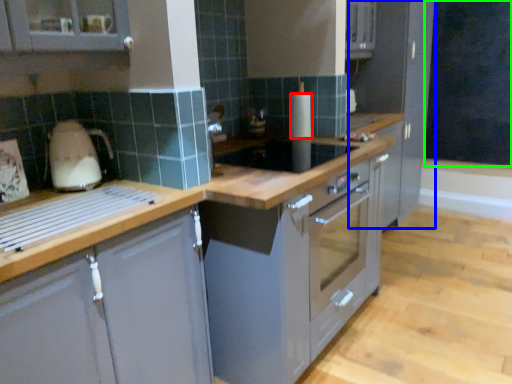
Question: Which is nearer to the kitchen appliance (highlighted by a red box)? cabinetry (highlighted by a blue box) or dark (highlighted by a green box).

Choices:
 (A) cabinetry
 (B) dark

Answer: (A)